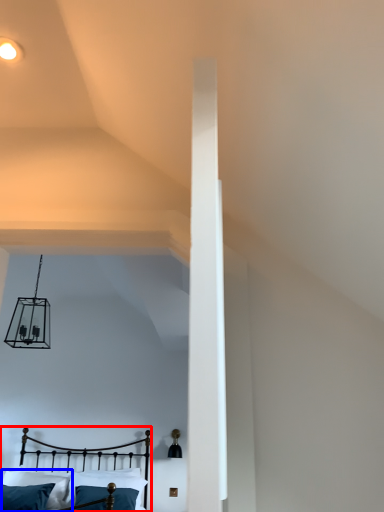
Question: Which of the following is the farthest to the observer, bed (highlighted by a red box) or pillow (highlighted by a blue box)?

Choices:
 (A) bed
 (B) pillow

Answer: (B)